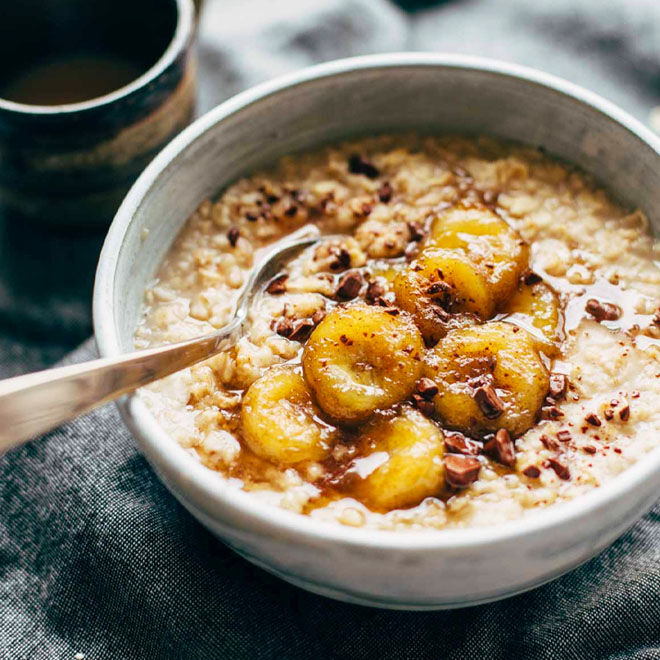
Image resolution: width=660 pixels, height=660 pixels. What are the coordinates of `spoon` in the screenshot? It's located at (189, 348).